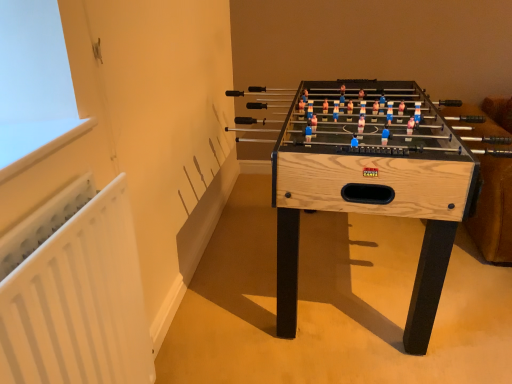
Question: Should I look upward or downward to see natural wood foosball table at center?

Choices:
 (A) up
 (B) down

Answer: (A)